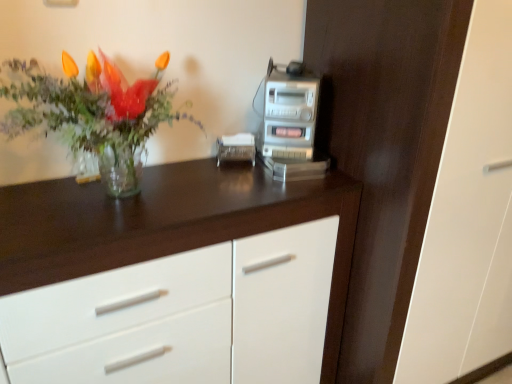
The height and width of the screenshot is (384, 512). Find the location of `vacant space to the right of transparent glass vase at left`. vacant space to the right of transparent glass vase at left is located at coordinates (225, 193).